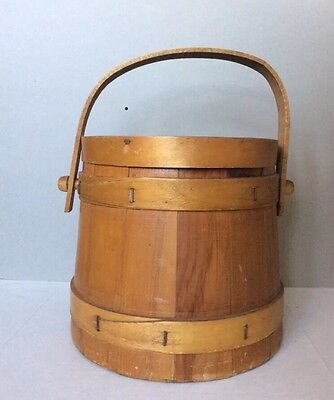
Find the location of a particular element. Image resolution: width=334 pixels, height=400 pixels. wooden "u" shaped handle is located at coordinates (196, 50).